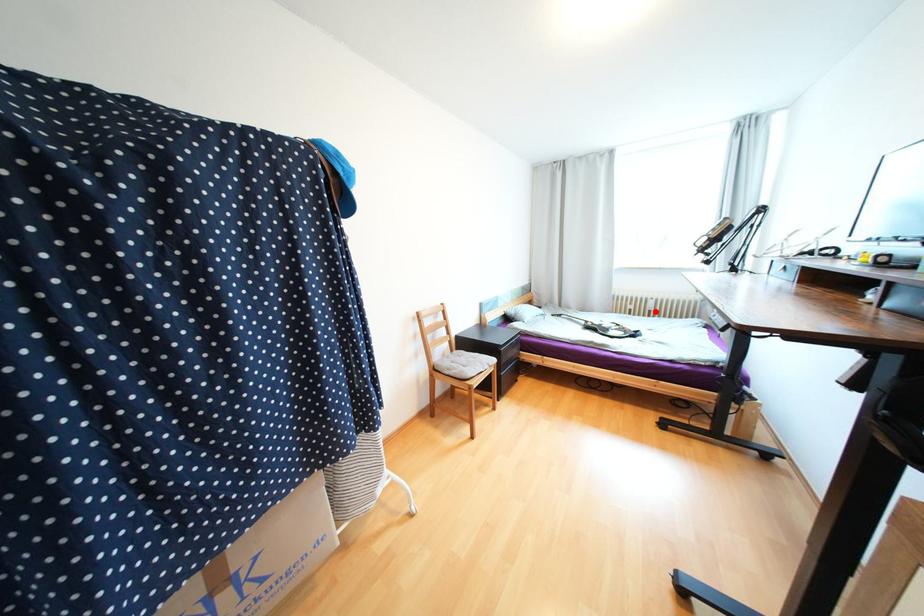
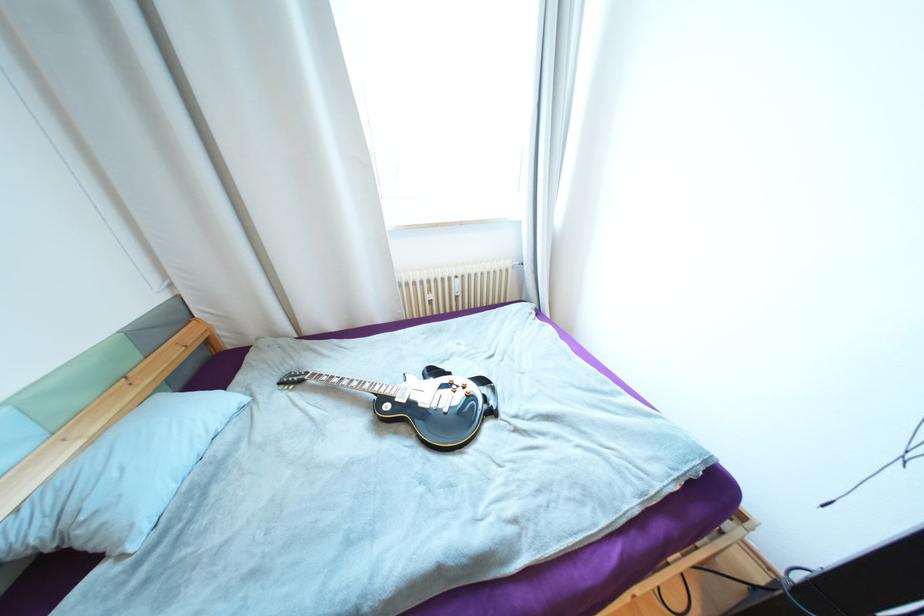
Question: I am providing you with two images of the same scene from different viewpoints. In image1, a red point is highlighted. Considering the same 3D point in image2, which of the following is correct?

Choices:
 (A) It is closer
 (B) It is farther

Answer: (B)